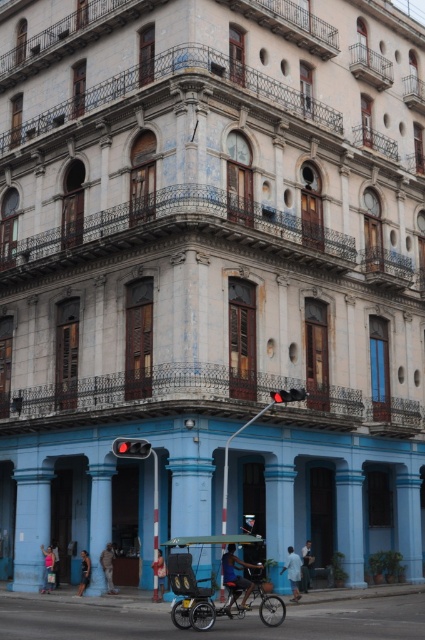
You are standing in front of the corner building and notice a point marked at coordinates (292,572). Based on the scene description, what object or feature is located at this point?

The point at (292,572) corresponds to the light blue fabric at lower center.